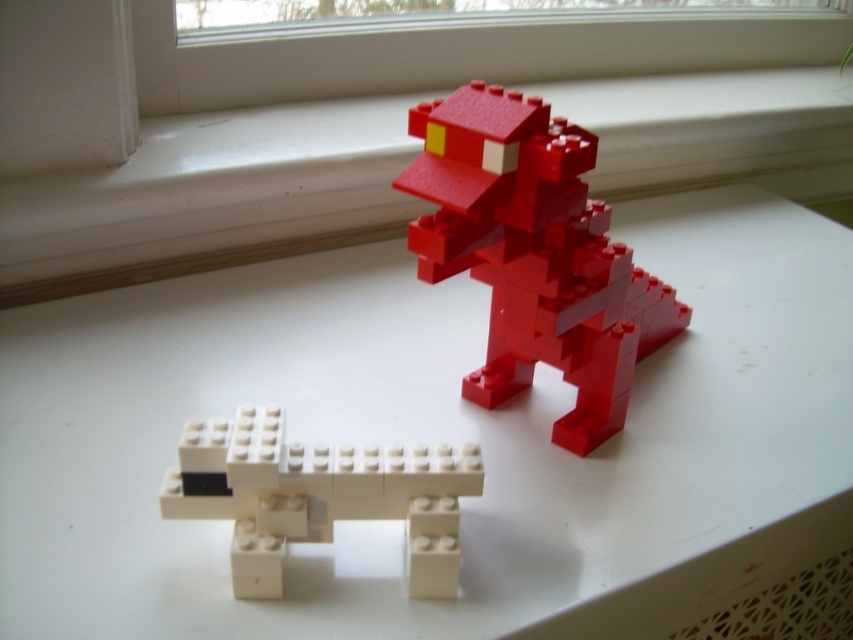
Question: Estimate the real-world distances between objects in this image. Which object is closer to the matte plastic dinosaur at upper center?

Choices:
 (A) white smooth window sill at upper center
 (B) white matte table at center

Answer: (B)

Question: Does matte plastic dinosaur at upper center have a smaller size compared to ivory matte/soft plastic toy horse at lower center?

Choices:
 (A) yes
 (B) no

Answer: (B)

Question: Can you confirm if white smooth window sill at upper center is wider than ivory matte/soft plastic toy horse at lower center?

Choices:
 (A) no
 (B) yes

Answer: (B)

Question: Which of the following is the closest to the observer?

Choices:
 (A) matte plastic dinosaur at upper center
 (B) ivory matte/soft plastic toy horse at lower center
 (C) white matte table at center

Answer: (C)

Question: Considering the real-world distances, which object is farthest from the white matte table at center?

Choices:
 (A) ivory matte/soft plastic toy horse at lower center
 (B) matte plastic dinosaur at upper center
 (C) white smooth window sill at upper center

Answer: (C)

Question: Can you confirm if white smooth window sill at upper center is smaller than ivory matte/soft plastic toy horse at lower center?

Choices:
 (A) yes
 (B) no

Answer: (B)